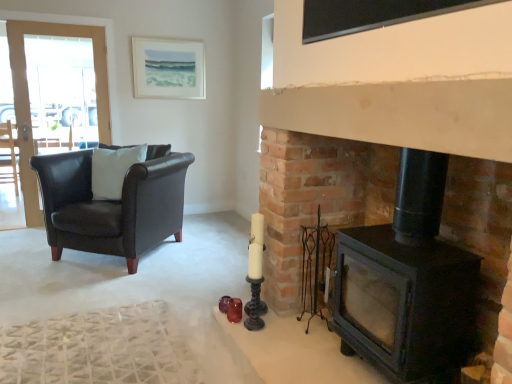
This screenshot has height=384, width=512. Describe the element at coordinates (29, 103) in the screenshot. I see `clear glass screen door at left` at that location.

In order to face black matte fireplace at right, should I rotate leftwards or rightwards?

Rotate right and turn 18.649 degrees.

This screenshot has height=384, width=512. What do you see at coordinates (371, 14) in the screenshot?
I see `black glass window screen at upper center` at bounding box center [371, 14].

What are the coordinates of `matte white picture frame at upper center` in the screenshot? It's located at (168, 68).

Is matte black leather armchair at left, the second chair in the left-to-right sequence, bigger or smaller than clear glass screen door at left?

Considering their sizes, matte black leather armchair at left, the second chair in the left-to-right sequence, takes up more space than clear glass screen door at left.

From the image's perspective, which object appears higher, matte black leather armchair at left, the second chair viewed from the back, or clear glass screen door at left?

clear glass screen door at left, from the image's perspective.

Could you tell me if matte black leather armchair at left, the second chair viewed from the back, is facing clear glass screen door at left?

No, matte black leather armchair at left, the second chair viewed from the back, is not facing towards clear glass screen door at left.

Does point (103, 145) come in front of point (20, 56)?

No, it is behind (20, 56).

Is matte white picture frame at upper center inside or outside of white matte pillow at left?

matte white picture frame at upper center is located beyond the bounds of white matte pillow at left.

Could you tell me if matte white picture frame at upper center is turned towards white matte pillow at left?

No, matte white picture frame at upper center is not turned towards white matte pillow at left.

Between matte white picture frame at upper center and white matte pillow at left, which one has less height?

With less height is white matte pillow at left.

From a real-world perspective, between black glass window screen at upper center and white matte pillow at left, who is vertically higher?

black glass window screen at upper center, from a real-world perspective.

The image size is (512, 384). Find the location of `window screen above the white matte pillow at left (from a real-world perspective)`. window screen above the white matte pillow at left (from a real-world perspective) is located at coordinates (371, 14).

Considering the positions of points (352, 16) and (116, 167), is point (352, 16) farther from camera compared to point (116, 167)?

No.

Can you confirm if dark brown leather armchair at left, acting as the first chair starting from the left, is positioned to the left of black glass window screen at upper center?

Yes, dark brown leather armchair at left, acting as the first chair starting from the left, is to the left of black glass window screen at upper center.

From a real-world perspective, which is physically above, dark brown leather armchair at left, which is the first chair from back to front, or black glass window screen at upper center?

In real-world perspective, black glass window screen at upper center is above.

Does dark brown leather armchair at left, the 2th chair when ordered from front to back, turn towards black glass window screen at upper center?

No, dark brown leather armchair at left, the 2th chair when ordered from front to back, is not aimed at black glass window screen at upper center.

Considering the sizes of dark brown leather armchair at left, the 2th chair when ordered from front to back, and black glass window screen at upper center in the image, is dark brown leather armchair at left, the 2th chair when ordered from front to back, wider or thinner than black glass window screen at upper center?

dark brown leather armchair at left, the 2th chair when ordered from front to back, is wider than black glass window screen at upper center.

From a real-world perspective, is black matte fireplace at right over dark brown leather armchair at left, acting as the first chair starting from the left?

Yes.

Which is in front, black matte fireplace at right or dark brown leather armchair at left, acting as the first chair starting from the left?

black matte fireplace at right is more forward.

Is point (297, 281) positioned in front of point (11, 154)?

Yes.

Is black matte fireplace at right looking in the opposite direction of dark brown leather armchair at left, the second chair viewed from the right?

black matte fireplace at right is not turned away from dark brown leather armchair at left, the second chair viewed from the right.

From a real-world perspective, relative to matte black leather armchair at left, the first chair when ordered from right to left, is white matte pillow at left vertically above or below?

white matte pillow at left is situated higher than matte black leather armchair at left, the first chair when ordered from right to left, in the real world.

From the image's perspective, between white matte pillow at left and matte black leather armchair at left, which is counted as the first chair, starting from the front, which one is located above?

white matte pillow at left appears higher in the image.

Considering the sizes of objects white matte pillow at left and matte black leather armchair at left, the first chair when ordered from right to left, in the image provided, who is thinner, white matte pillow at left or matte black leather armchair at left, the first chair when ordered from right to left,?

With smaller width is white matte pillow at left.

Which of these two, white matte pillow at left or matte black leather armchair at left, the first chair when ordered from right to left, is smaller?

white matte pillow at left.

Considering the positions of objects black matte fireplace at right and black glass window screen at upper center in the image provided, who is in front, black matte fireplace at right or black glass window screen at upper center?

black glass window screen at upper center.

Does point (297, 284) lie behind point (403, 11)?

That is True.

Looking at the image, does black matte fireplace at right seem bigger or smaller compared to black glass window screen at upper center?

In the image, black matte fireplace at right appears to be larger than black glass window screen at upper center.

Is black matte fireplace at right taller than black glass window screen at upper center?

Correct, black matte fireplace at right is much taller as black glass window screen at upper center.

The width and height of the screenshot is (512, 384). I want to click on chair on the right of clear glass screen door at left, so click(112, 204).

Where is `pillow in front of the matte white picture frame at upper center`? Image resolution: width=512 pixels, height=384 pixels. pillow in front of the matte white picture frame at upper center is located at coordinates (113, 170).

Considering their positions, is matte white picture frame at upper center positioned closer to white matte pillow at left than black matte fireplace at right?

matte white picture frame at upper center is closer to white matte pillow at left.

Looking at the image, which one is located further to black matte fireplace at right, clear glass screen door at left or black glass window screen at upper center?

clear glass screen door at left.

Estimate the real-world distances between objects in this image. Which object is closer to clear glass screen door at left, matte white picture frame at upper center or dark brown leather armchair at left, the second chair viewed from the right?

dark brown leather armchair at left, the second chair viewed from the right, lies closer to clear glass screen door at left than the other object.

Based on their spatial positions, is matte black leather armchair at left, the first chair when ordered from right to left, or matte white picture frame at upper center further from dark brown leather armchair at left, acting as the first chair starting from the left?

Based on the image, matte white picture frame at upper center appears to be further to dark brown leather armchair at left, acting as the first chair starting from the left.

Based on their spatial positions, is dark brown leather armchair at left, the 2th chair when ordered from front to back, or matte white picture frame at upper center closer to black matte fireplace at right?

Among the two, matte white picture frame at upper center is located nearer to black matte fireplace at right.

When comparing their distances from black matte fireplace at right, does matte white picture frame at upper center or dark brown leather armchair at left, acting as the first chair starting from the left, seem further?

Based on the image, dark brown leather armchair at left, acting as the first chair starting from the left, appears to be further to black matte fireplace at right.

From the image, which object appears to be farther from clear glass screen door at left, white matte pillow at left or matte black leather armchair at left, the second chair in the left-to-right sequence?

Based on the image, matte black leather armchair at left, the second chair in the left-to-right sequence, appears to be further to clear glass screen door at left.

When comparing their distances from white matte pillow at left, does matte black leather armchair at left, which is counted as the first chair, starting from the front, or black matte fireplace at right seem further?

black matte fireplace at right is positioned further to the anchor white matte pillow at left.

The image size is (512, 384). Find the location of `fireplace between black glass window screen at upper center and dark brown leather armchair at left, the second chair viewed from the right, from front to back`. fireplace between black glass window screen at upper center and dark brown leather armchair at left, the second chair viewed from the right, from front to back is located at coordinates (317, 198).

In order to click on picture frame between dark brown leather armchair at left, which is the first chair from back to front, and black matte fireplace at right from left to right in this screenshot , I will do `click(168, 68)`.

The image size is (512, 384). I want to click on pillow between dark brown leather armchair at left, the 2th chair when ordered from front to back, and black matte fireplace at right from left to right, so click(113, 170).

I want to click on pillow between clear glass screen door at left and black matte fireplace at right, so click(113, 170).